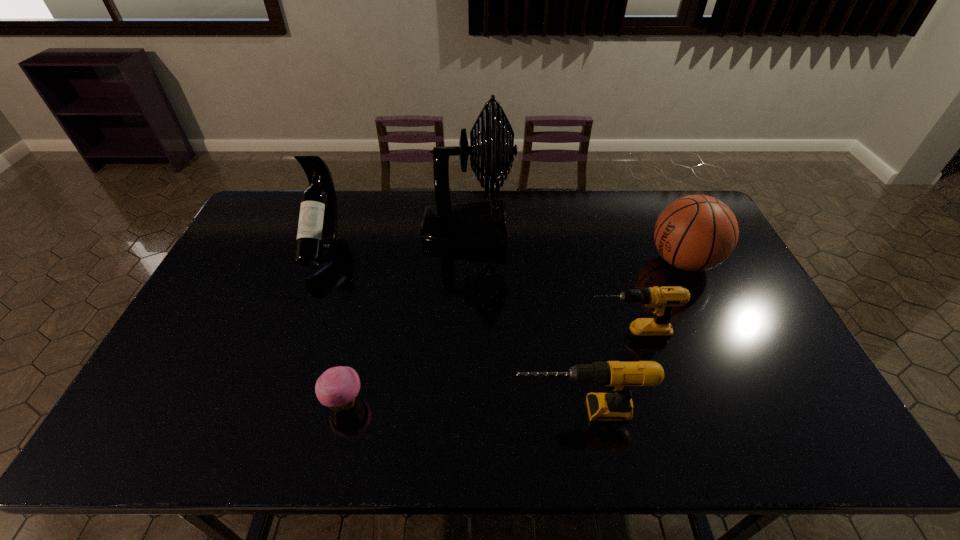
At what (x,y) coordinates should I click in order to perform the action: click on the tallest object. Please return your answer as a coordinate pair (x, y). The width and height of the screenshot is (960, 540). Looking at the image, I should click on (481, 226).

Locate an element on the screen. This screenshot has height=540, width=960. the fifth shortest object is located at coordinates (317, 230).

The width and height of the screenshot is (960, 540). I want to click on the leftmost object, so click(x=317, y=230).

The image size is (960, 540). Identify the location of the rightmost object. (694, 233).

This screenshot has height=540, width=960. Find the location of `the fourth shortest object`. the fourth shortest object is located at coordinates (694, 233).

Identify the location of the fourth farthest object. (660, 300).

What are the coordinates of `the nearer drill` in the screenshot? It's located at (618, 376).

Find the location of a particular element. Image resolution: width=960 pixels, height=540 pixels. the shortest object is located at coordinates (337, 388).

Find the location of a particular element. cupcake is located at coordinates (337, 388).

I want to click on vacant area situated in front of the tallest object to blow air, so click(x=612, y=231).